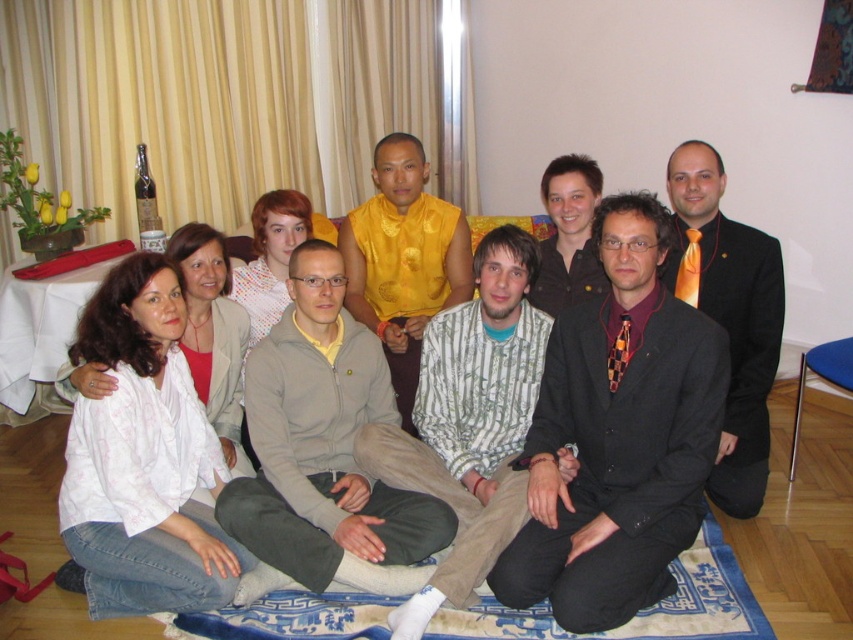
Can you confirm if black suit at center is taller than blue woven mat at lower center?

Correct, black suit at center is much taller as blue woven mat at lower center.

Is black suit at center shorter than blue woven mat at lower center?

In fact, black suit at center may be taller than blue woven mat at lower center.

Between point (701, 454) and point (496, 634), which one is positioned in front?

Point (701, 454) is more forward.

Locate an element on the screen. The height and width of the screenshot is (640, 853). black suit at center is located at coordinates (618, 435).

Between black suit at center and white cotton shirt at lower left, which one appears on the right side from the viewer's perspective?

Positioned to the right is white cotton shirt at lower left.

Between black suit at center and white cotton shirt at lower left, which one appears on the left side from the viewer's perspective?

Positioned to the left is black suit at center.

Which is behind, point (682, 467) or point (560, 300)?

The point (560, 300) is more distant.

You are a GUI agent. You are given a task and a screenshot of the screen. Output one action in this format:
    pyautogui.click(x=<x>, y=<y>)
    Task: Click on the black suit at center
    The height and width of the screenshot is (640, 853).
    Given the screenshot: What is the action you would take?
    pyautogui.click(x=618, y=435)

Does light gray fleece jacket at center have a lesser height compared to striped cotton shirt at center?

Correct, light gray fleece jacket at center is not as tall as striped cotton shirt at center.

What do you see at coordinates (323, 445) in the screenshot?
I see `light gray fleece jacket at center` at bounding box center [323, 445].

Who is more distant from viewer, (x=366, y=547) or (x=498, y=264)?

Positioned behind is point (x=498, y=264).

Where is `light gray fleece jacket at center`? light gray fleece jacket at center is located at coordinates (323, 445).